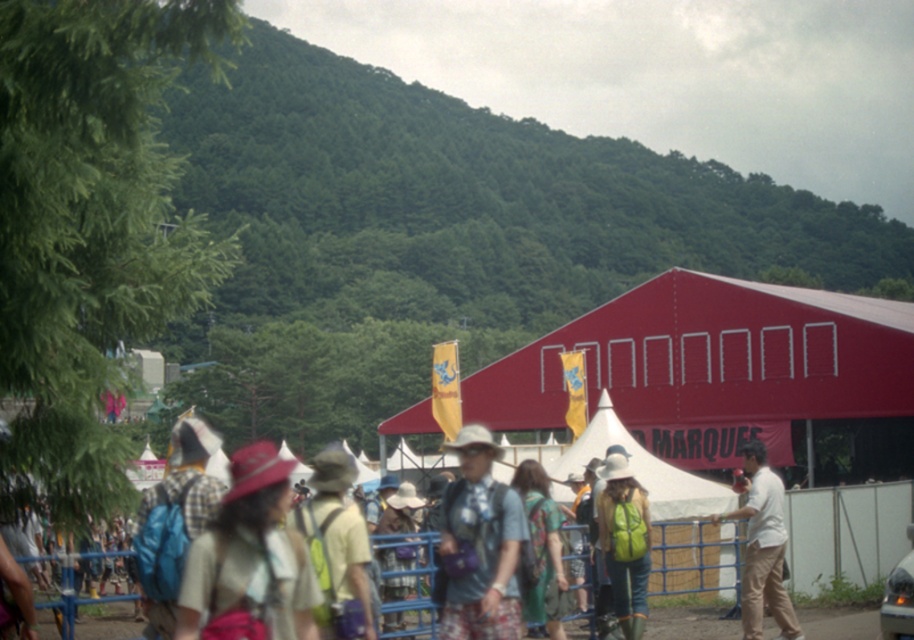
You are standing at the camera position and want to pick up the light brown fabric hat at center. Can you reach it without moving your feet?

The light brown fabric hat at center is 25.47 feet away from the camera, so you cannot reach it without moving your feet.

You are a photographer trying to capture both the matte pink hat at center and the green matte backpack at center in a single frame. Since your camera has a limited field of view, you need to know which object is wider to adjust your lens. Which one is wider?

The matte pink hat at center is wider than the green matte backpack at center according to the description.

You are standing at the center of the pathway in the festival scene. There is a red tent with white lettering in the midground and a matte pink hat at center. Where is the point located at coordinates (x=250, y=561)?

The point at coordinates (x=250, y=561) is on the matte pink hat at center.